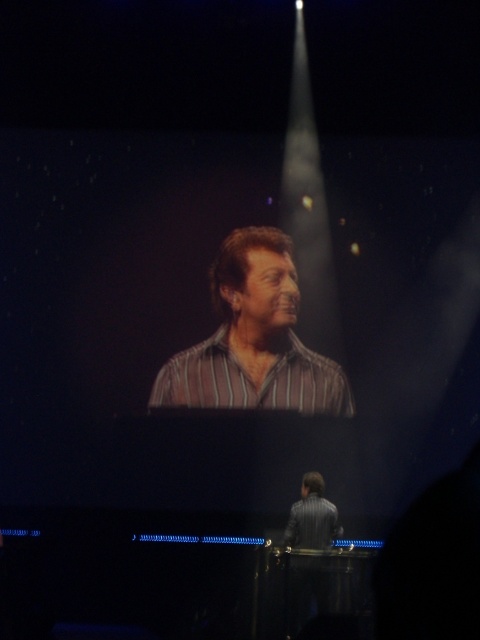
How much distance is there between striped shirt at center and striped cotton shirt at center?

striped shirt at center is 5.45 inches from striped cotton shirt at center.

Is striped shirt at center below striped cotton shirt at center?

Incorrect, striped shirt at center is not positioned below striped cotton shirt at center.

What do you see at coordinates (253, 339) in the screenshot? The width and height of the screenshot is (480, 640). I see `striped shirt at center` at bounding box center [253, 339].

At what (x,y) coordinates should I click in order to perform the action: click on striped shirt at center. Please return your answer as a coordinate pair (x, y). The height and width of the screenshot is (640, 480). Looking at the image, I should click on (253, 339).

Who is shorter, striped cotton shirt at center or striped fabric shirt at lower center?

striped fabric shirt at lower center

This screenshot has height=640, width=480. Describe the element at coordinates (251, 380) in the screenshot. I see `striped cotton shirt at center` at that location.

Is point (175, 403) positioned after point (299, 515)?

Yes, it is behind point (299, 515).

Where is `striped cotton shirt at center`? Image resolution: width=480 pixels, height=640 pixels. striped cotton shirt at center is located at coordinates (251, 380).

Is striped shirt at center positioned behind striped fabric shirt at lower center?

Yes, it is behind striped fabric shirt at lower center.

Does point (159, 387) come in front of point (309, 528)?

No, (159, 387) is behind (309, 528).

What do you see at coordinates (253, 339) in the screenshot? The width and height of the screenshot is (480, 640). I see `striped shirt at center` at bounding box center [253, 339].

At what (x,y) coordinates should I click in order to perform the action: click on striped shirt at center. Please return your answer as a coordinate pair (x, y). Looking at the image, I should click on (253, 339).